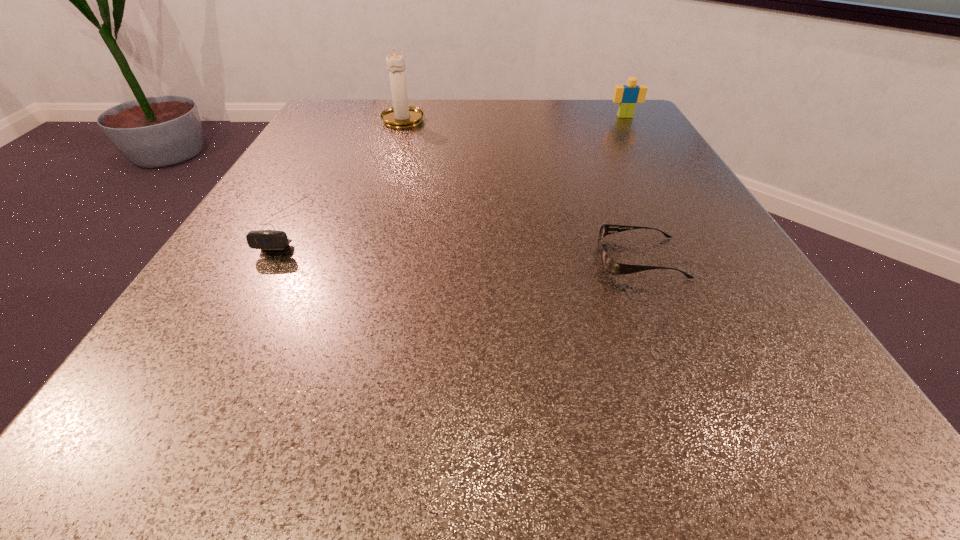
Where is `vacant space positioned 0.050m on the face of the rightmost object`? vacant space positioned 0.050m on the face of the rightmost object is located at coordinates (632, 127).

You are a GUI agent. You are given a task and a screenshot of the screen. Output one action in this format:
    pyautogui.click(x=<x>, y=<y>)
    Task: Click on the vacant space located 0.260m on the front-facing side of the second shortest object
    The image size is (960, 540).
    Given the screenshot: What is the action you would take?
    pyautogui.click(x=176, y=416)

Locate an element on the screen. This screenshot has width=960, height=540. free space located on the front-facing side of the sunglasses is located at coordinates point(340,258).

At what (x,y) coordinates should I click in order to perform the action: click on blank space located on the front-facing side of the sunglasses. Please return your answer as a coordinate pair (x, y). Looking at the image, I should click on (468, 258).

Locate an element on the screen. The height and width of the screenshot is (540, 960). free space located 0.360m on the front-facing side of the sunglasses is located at coordinates (353, 258).

Find the location of a particular element. This screenshot has width=960, height=540. candle holder present at the far edge is located at coordinates (401, 115).

You are a GUI agent. You are given a task and a screenshot of the screen. Output one action in this format:
    pyautogui.click(x=<x>, y=<y>)
    Task: Click on the Lego located at the far edge
    Image resolution: width=960 pixels, height=540 pixels.
    Given the screenshot: What is the action you would take?
    pyautogui.click(x=627, y=96)

The height and width of the screenshot is (540, 960). I want to click on candle holder located in the left edge section of the desktop, so click(401, 115).

Where is `webcam that is at the left edge`? This screenshot has height=540, width=960. webcam that is at the left edge is located at coordinates point(266,240).

Where is `Lego located in the right edge section of the desktop`? The image size is (960, 540). Lego located in the right edge section of the desktop is located at coordinates (627, 96).